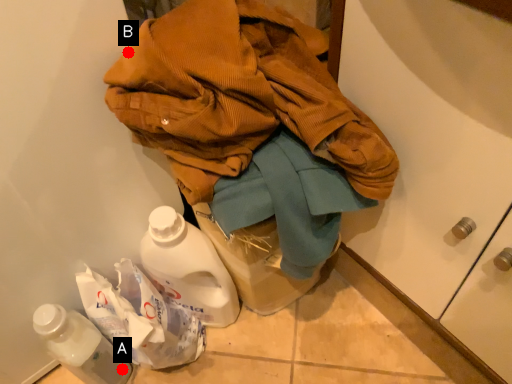
Question: Two points are circled on the image, labeled by A and B beside each circle. Among these points, which one is nearest to the camera?

Choices:
 (A) A is closer
 (B) B is closer

Answer: (B)